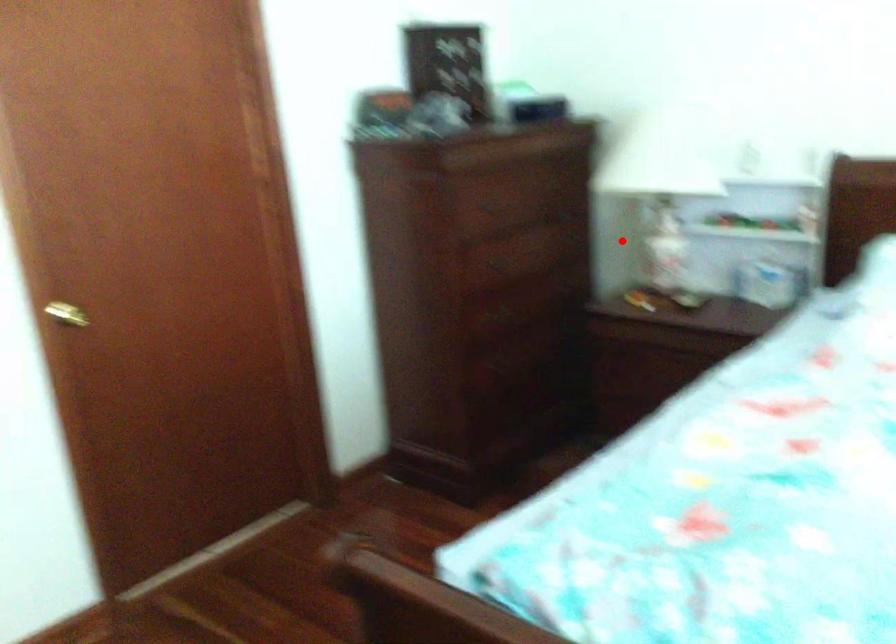
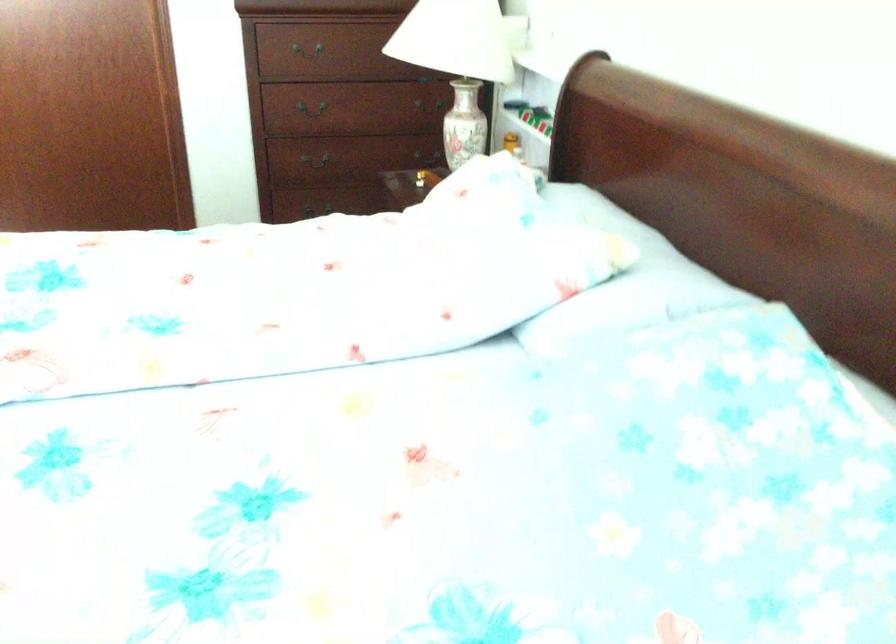
Where in the second image is the point corresponding to the highlighted location from the first image?

(463, 124)